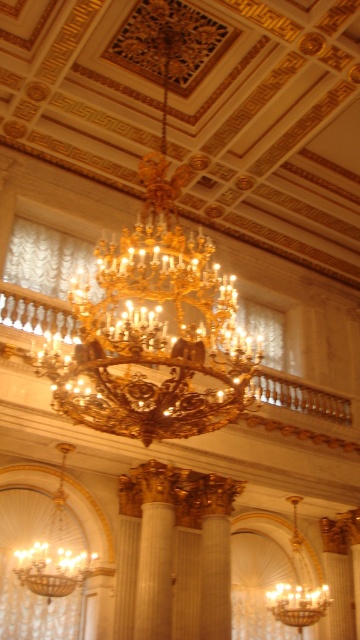
How far apart are matte gold chandelier at lower left and gold metallic chandelier at center?

matte gold chandelier at lower left and gold metallic chandelier at center are 59.17 feet apart from each other.

Between matte gold chandelier at lower left and gold metallic chandelier at center, which one is positioned higher?

matte gold chandelier at lower left

Find the location of a particular element. The width and height of the screenshot is (360, 640). matte gold chandelier at lower left is located at coordinates (54, 552).